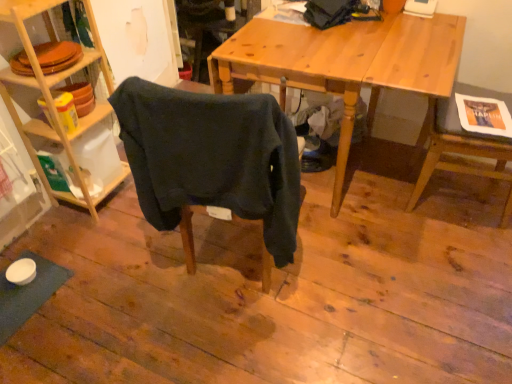
Describe the element at coordinates (51, 97) in the screenshot. This screenshot has height=384, width=512. I see `woodenshelves at left` at that location.

Measure the distance between point [153,197] and camera.

The distance of point [153,197] from camera is 4.50 feet.

Image resolution: width=512 pixels, height=384 pixels. Find the location of `wooden chair at right, the first chair positioned from the right`. wooden chair at right, the first chair positioned from the right is located at coordinates (459, 164).

From a real-world perspective, does wooden desk at center stand above woodenshelves at left?

No, from a real-world perspective, wooden desk at center is not on top of woodenshelves at left.

Consider the image. Considering the positions of objects wooden desk at center and woodenshelves at left in the image provided, who is in front, wooden desk at center or woodenshelves at left?

Positioned in front is woodenshelves at left.

Looking at this image, can you tell me how much wooden desk at center and woodenshelves at left differ in facing direction?

88.9 degrees separate the facing orientations of wooden desk at center and woodenshelves at left.

How distant is wooden chair at right, placed as the second chair when sorted from left to right, from wooden desk at center?

They are 18.38 inches apart.

Is wooden chair at right, placed as the second chair when sorted from left to right, inside or outside of wooden desk at center?

wooden chair at right, placed as the second chair when sorted from left to right, is spatially situated outside wooden desk at center.

Which is more to the right, wooden chair at right, placed as the second chair when sorted from left to right, or wooden desk at center?

wooden chair at right, placed as the second chair when sorted from left to right.

Between wooden chair at right, placed as the second chair when sorted from left to right, and wooden desk at center, which one has smaller size?

Smaller between the two is wooden chair at right, placed as the second chair when sorted from left to right.

From a real-world perspective, is dark blue fabric chair at center, the 2th chair positioned from the right, on woodenshelves at left?

Correct, in the physical world, dark blue fabric chair at center, the 2th chair positioned from the right, is higher than woodenshelves at left.

Is the depth of dark blue fabric chair at center, the 2th chair positioned from the right, greater than that of woodenshelves at left?

No, it is in front of woodenshelves at left.

Is dark blue fabric chair at center, marked as the first chair in a left-to-right arrangement, oriented towards woodenshelves at left?

No, dark blue fabric chair at center, marked as the first chair in a left-to-right arrangement, is not oriented towards woodenshelves at left.

Is there a large distance between dark blue fabric chair at center, the 2th chair positioned from the right, and woodenshelves at left?

No, dark blue fabric chair at center, the 2th chair positioned from the right, is not far from woodenshelves at left.

Which of these two, wooden chair at right, the first chair positioned from the right, or woodenshelves at left, is wider?

With larger width is wooden chair at right, the first chair positioned from the right.

Between wooden chair at right, placed as the second chair when sorted from left to right, and woodenshelves at left, which one has more height?

woodenshelves at left is taller.

Measure the distance from wooden chair at right, the first chair positioned from the right, to woodenshelves at left.

They are 5.14 feet apart.

Considering the positions of objects wooden chair at right, placed as the second chair when sorted from left to right, and woodenshelves at left in the image provided, who is more to the right, wooden chair at right, placed as the second chair when sorted from left to right, or woodenshelves at left?

Positioned to the right is wooden chair at right, placed as the second chair when sorted from left to right.

Which of these two, wooden desk at center or wooden chair at right, placed as the second chair when sorted from left to right, stands taller?

With more height is wooden chair at right, placed as the second chair when sorted from left to right.

Do you think wooden desk at center is within wooden chair at right, the first chair positioned from the right, or outside of it?

wooden desk at center is not inside wooden chair at right, the first chair positioned from the right, it's outside.

Does point (232, 49) lie in front of point (478, 150)?

Yes, it is in front of point (478, 150).

Looking at this image, from the image's perspective, between wooden desk at center and wooden chair at right, the first chair positioned from the right, which one is located above?

wooden desk at center appears higher in the image.

Can you confirm if woodenshelves at left is positioned to the right of dark blue fabric chair at center, marked as the first chair in a left-to-right arrangement?

No, woodenshelves at left is not to the right of dark blue fabric chair at center, marked as the first chair in a left-to-right arrangement.

Looking at this image, is woodenshelves at left oriented away from dark blue fabric chair at center, marked as the first chair in a left-to-right arrangement?

No, dark blue fabric chair at center, marked as the first chair in a left-to-right arrangement, is not at the back of woodenshelves at left.

Is woodenshelves at left shorter than dark blue fabric chair at center, marked as the first chair in a left-to-right arrangement?

Incorrect, the height of woodenshelves at left does not fall short of that of dark blue fabric chair at center, marked as the first chair in a left-to-right arrangement.

Which is correct: woodenshelves at left is inside dark blue fabric chair at center, marked as the first chair in a left-to-right arrangement, or outside of it?

woodenshelves at left is spatially situated outside dark blue fabric chair at center, marked as the first chair in a left-to-right arrangement.

Considering the relative sizes of wooden chair at right, placed as the second chair when sorted from left to right, and dark blue fabric chair at center, marked as the first chair in a left-to-right arrangement, in the image provided, is wooden chair at right, placed as the second chair when sorted from left to right, smaller than dark blue fabric chair at center, marked as the first chair in a left-to-right arrangement,?

Incorrect, wooden chair at right, placed as the second chair when sorted from left to right, is not smaller in size than dark blue fabric chair at center, marked as the first chair in a left-to-right arrangement.

Is wooden chair at right, placed as the second chair when sorted from left to right, surrounding dark blue fabric chair at center, marked as the first chair in a left-to-right arrangement?

No.

Which is farther from the camera, [490,157] or [265,115]?

The point [490,157] is farther from the camera.

From a real-world perspective, is wooden chair at right, placed as the second chair when sorted from left to right, positioned under dark blue fabric chair at center, the 2th chair positioned from the right, based on gravity?

Yes, from a real-world perspective, wooden chair at right, placed as the second chair when sorted from left to right, is below dark blue fabric chair at center, the 2th chair positioned from the right.

The width and height of the screenshot is (512, 384). I want to click on shelf above the wooden desk at center (from a real-world perspective), so click(x=51, y=97).

Find the location of a particular element. The height and width of the screenshot is (384, 512). desk behind the wooden chair at right, the first chair positioned from the right is located at coordinates (344, 63).

Based on their spatial positions, is wooden chair at right, placed as the second chair when sorted from left to right, or dark blue fabric chair at center, the 2th chair positioned from the right, further from wooden desk at center?

dark blue fabric chair at center, the 2th chair positioned from the right, is positioned further to the anchor wooden desk at center.

When comparing their distances from woodenshelves at left, does wooden chair at right, the first chair positioned from the right, or wooden desk at center seem further?

wooden chair at right, the first chair positioned from the right, is further to woodenshelves at left.

Considering their positions, is wooden chair at right, the first chair positioned from the right, positioned further to dark blue fabric chair at center, marked as the first chair in a left-to-right arrangement, than woodenshelves at left?

wooden chair at right, the first chair positioned from the right.

Which object lies nearer to the anchor point wooden chair at right, the first chair positioned from the right, dark blue fabric chair at center, marked as the first chair in a left-to-right arrangement, or wooden desk at center?

wooden desk at center is positioned closer to the anchor wooden chair at right, the first chair positioned from the right.

Considering their positions, is wooden desk at center positioned closer to dark blue fabric chair at center, the 2th chair positioned from the right, than woodenshelves at left?

Based on the image, wooden desk at center appears to be nearer to dark blue fabric chair at center, the 2th chair positioned from the right.

Based on the photo, looking at the image, which one is located closer to dark blue fabric chair at center, marked as the first chair in a left-to-right arrangement, wooden chair at right, placed as the second chair when sorted from left to right, or wooden desk at center?

The object closer to dark blue fabric chair at center, marked as the first chair in a left-to-right arrangement, is wooden desk at center.

When comparing their distances from dark blue fabric chair at center, marked as the first chair in a left-to-right arrangement, does woodenshelves at left or wooden desk at center seem closer?

Based on the image, wooden desk at center appears to be nearer to dark blue fabric chair at center, marked as the first chair in a left-to-right arrangement.

Based on their spatial positions, is woodenshelves at left or wooden desk at center closer to wooden chair at right, the first chair positioned from the right?

The object closer to wooden chair at right, the first chair positioned from the right, is wooden desk at center.

This screenshot has width=512, height=384. I want to click on desk between dark blue fabric chair at center, the 2th chair positioned from the right, and wooden chair at right, placed as the second chair when sorted from left to right, so click(344, 63).

Where is `chair located between woodenshelves at left and wooden desk at center in the left-right direction`? chair located between woodenshelves at left and wooden desk at center in the left-right direction is located at coordinates point(212,161).

Where is `desk between woodenshelves at left and wooden chair at right, placed as the second chair when sorted from left to right, from left to right`? desk between woodenshelves at left and wooden chair at right, placed as the second chair when sorted from left to right, from left to right is located at coordinates (344, 63).

The image size is (512, 384). What are the coordinates of `chair between woodenshelves at left and wooden chair at right, the first chair positioned from the right, in the horizontal direction` in the screenshot? It's located at (212, 161).